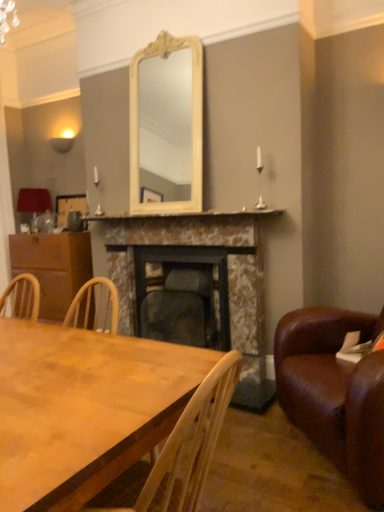
Question: Does wooden table at lower left have a greater height compared to brown leather couch at right?

Choices:
 (A) no
 (B) yes

Answer: (A)

Question: Is wooden table at lower left outside of brown leather couch at right?

Choices:
 (A) yes
 (B) no

Answer: (A)

Question: Does wooden table at lower left lie behind brown leather couch at right?

Choices:
 (A) no
 (B) yes

Answer: (A)

Question: Would you say wooden table at lower left contains brown leather couch at right?

Choices:
 (A) yes
 (B) no

Answer: (B)

Question: Is wooden table at lower left at the left side of brown leather couch at right?

Choices:
 (A) yes
 (B) no

Answer: (A)

Question: Is the surface of wooden table at lower left in direct contact with brown leather couch at right?

Choices:
 (A) no
 (B) yes

Answer: (A)

Question: From a real-world perspective, is matte red lampshade at left positioned under wooden table at lower left based on gravity?

Choices:
 (A) no
 (B) yes

Answer: (A)

Question: Considering the relative sizes of matte red lampshade at left and wooden table at lower left in the image provided, is matte red lampshade at left thinner than wooden table at lower left?

Choices:
 (A) no
 (B) yes

Answer: (B)

Question: Is matte red lampshade at left aimed at wooden table at lower left?

Choices:
 (A) no
 (B) yes

Answer: (A)

Question: Is matte red lampshade at left not near wooden table at lower left?

Choices:
 (A) yes
 (B) no

Answer: (A)

Question: Is the position of matte red lampshade at left more distant than that of wooden table at lower left?

Choices:
 (A) no
 (B) yes

Answer: (B)

Question: Does matte red lampshade at left have a greater width compared to wooden table at lower left?

Choices:
 (A) yes
 (B) no

Answer: (B)

Question: Could you tell me if marble fireplace at center, the second fireplace viewed from the left, is turned towards matte red lampshade at left?

Choices:
 (A) no
 (B) yes

Answer: (A)